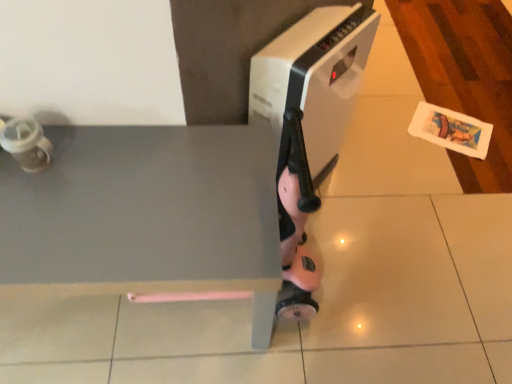
Question: Considering the relative positions of matte gray tile at center and white plastic heater at center in the image provided, is matte gray tile at center to the right of white plastic heater at center from the viewer's perspective?

Choices:
 (A) no
 (B) yes

Answer: (A)

Question: Is matte gray tile at center shorter than white plastic heater at center?

Choices:
 (A) no
 (B) yes

Answer: (B)

Question: Is matte gray tile at center positioned before white plastic heater at center?

Choices:
 (A) no
 (B) yes

Answer: (A)

Question: Is matte gray tile at center outside of white plastic heater at center?

Choices:
 (A) yes
 (B) no

Answer: (A)

Question: Is matte gray tile at center wider than white plastic heater at center?

Choices:
 (A) no
 (B) yes

Answer: (B)

Question: Do you think white plastic heater at center is within matte gray tile at center, or outside of it?

Choices:
 (A) outside
 (B) inside

Answer: (A)

Question: In terms of width, does white plastic heater at center look wider or thinner when compared to matte gray tile at center?

Choices:
 (A) thin
 (B) wide

Answer: (A)

Question: In the image, is white plastic heater at center positioned in front of or behind matte gray tile at center?

Choices:
 (A) front
 (B) behind

Answer: (A)

Question: From a real-world perspective, is white plastic heater at center above or below matte gray tile at center?

Choices:
 (A) below
 (B) above

Answer: (B)

Question: Does point (263, 62) appear closer or farther from the camera than point (184, 236)?

Choices:
 (A) closer
 (B) farther

Answer: (B)

Question: From a real-world perspective, is white plastic heater at center positioned above or below matte gray table at lower left?

Choices:
 (A) above
 (B) below

Answer: (A)

Question: Considering the positions of white plastic heater at center and matte gray table at lower left in the image, is white plastic heater at center bigger or smaller than matte gray table at lower left?

Choices:
 (A) small
 (B) big

Answer: (A)

Question: Do you think white plastic heater at center is within matte gray table at lower left, or outside of it?

Choices:
 (A) inside
 (B) outside

Answer: (B)

Question: Is matte gray tile at center taller or shorter than white plastic heater at center?

Choices:
 (A) tall
 (B) short

Answer: (B)

Question: Relative to white plastic heater at center, is matte gray tile at center in front or behind?

Choices:
 (A) front
 (B) behind

Answer: (B)